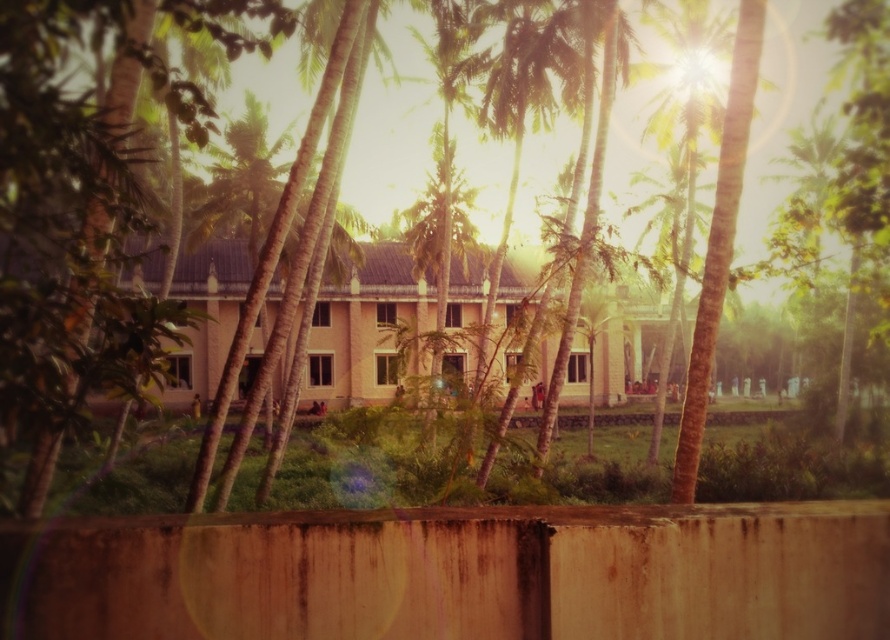
Based on the scene description, where is the rusty concrete fence at lower center located in terms of coordinates?

The rusty concrete fence at lower center is located at coordinates point (457, 573).

Looking at this image, you are standing 2 meters away from the point at coordinates point (596, 531). Can you reach the point without moving closer than 2 meters?

The distance of point (596, 531) from viewer is 3.46 meters. Since you are already 2 meters away, you need to move forward 1.46 meters to reach it, so you can reach the point by moving closer.

You are standing at the point with coordinates point (465,196) and want to walk to the point (391,605). According to the image, will you have to go around any obstacles between these two points?

Point (391,605) is in front of point (465,196), so you will not have to go around any obstacles between them.